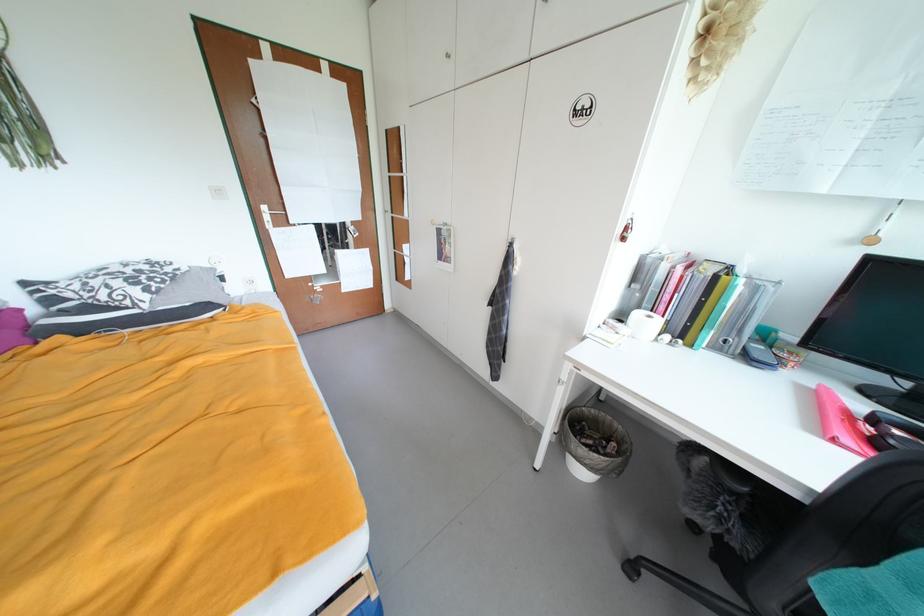
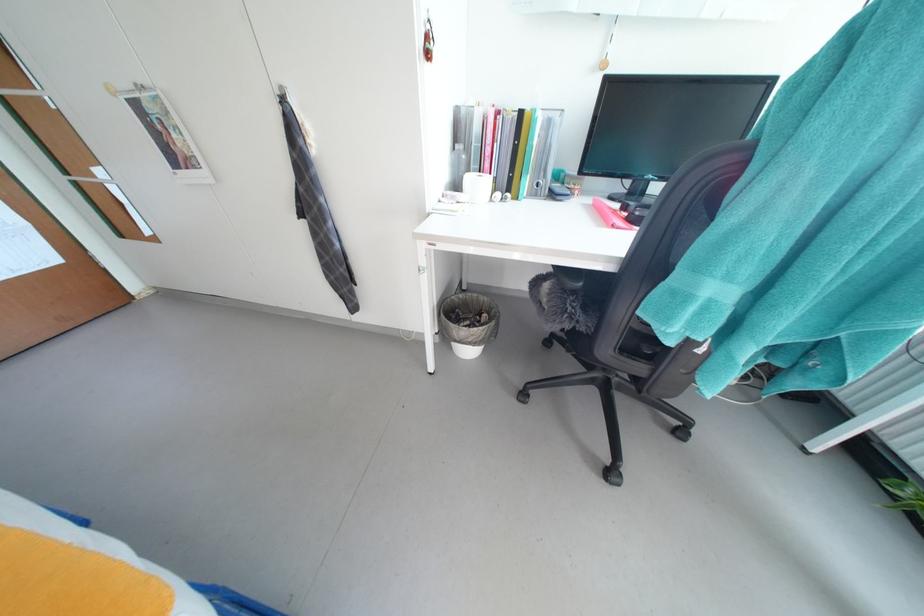
Where in the second image is the point corresponding to the point at 648,310 from the first image?

(477, 172)